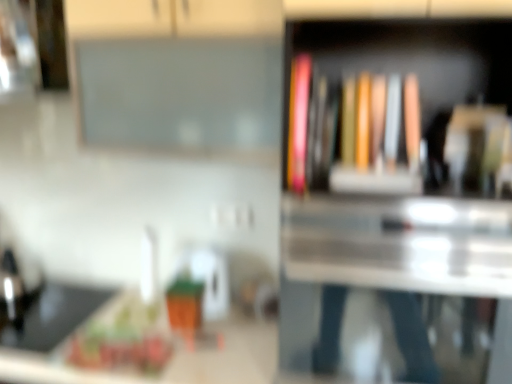
Where is `white glossy counter top at lower left`? The width and height of the screenshot is (512, 384). white glossy counter top at lower left is located at coordinates (168, 361).

What is the approximate width of white glossy kettle at center?

white glossy kettle at center is 5.50 inches in width.

In order to click on black matte sink at lower left in this screenshot , I will do click(x=38, y=301).

Find the location of a particular element. This screenshot has height=384, width=512. white glossy counter top at lower left is located at coordinates (168, 361).

Can you confirm if matte hardcover book at center, positioned as the first book in right-to-left order, is positioned to the left of white glossy counter top at lower left?

Incorrect, matte hardcover book at center, positioned as the first book in right-to-left order, is not on the left side of white glossy counter top at lower left.

Which is less distant, (x=315, y=166) or (x=146, y=382)?

The point (x=315, y=166) is in front.

From the image's perspective, which one is positioned higher, matte hardcover book at center, positioned as the first book in right-to-left order, or white glossy counter top at lower left?

matte hardcover book at center, positioned as the first book in right-to-left order.

Is the position of matte pink book at upper right, the first book from the left, less distant than that of black matte sink at lower left?

Yes, matte pink book at upper right, the first book from the left, is closer to the viewer.

From a real-world perspective, which object rests below the other?

From a 3D spatial view, black matte sink at lower left is below.

Looking at this image, between matte pink book at upper right, the first book from the left, and black matte sink at lower left, which one has larger size?

With larger size is black matte sink at lower left.

Is matte pink book at upper right, the first book from the left, inside or outside of black matte sink at lower left?

The correct answer is: outside.

Which is in front, point (429, 154) or point (80, 304)?

The point (429, 154) is more forward.

From a real-world perspective, relative to black matte sink at lower left, is wooden bookshelf at center vertically above or below?

wooden bookshelf at center is above black matte sink at lower left.

Is wooden bookshelf at center further to the viewer compared to black matte sink at lower left?

No, it is not.

Considering the relative sizes of wooden bookshelf at center and black matte sink at lower left in the image provided, is wooden bookshelf at center thinner than black matte sink at lower left?

No.

Is matte pink book at upper right, the first book from the left, surrounding white glossy counter top at lower left?

No, white glossy counter top at lower left is not a part of matte pink book at upper right, the first book from the left.

Between matte pink book at upper right, the second book viewed from the right, and white glossy counter top at lower left, which one has smaller width?

matte pink book at upper right, the second book viewed from the right, is thinner.

Identify the location of book that is the 2nd one when counting upward from the white glossy counter top at lower left (from the image's perspective). (298, 122).

From a real-world perspective, is matte pink book at upper right, the first book from the left, over white glossy counter top at lower left?

Yes, from a real-world perspective, matte pink book at upper right, the first book from the left, is on top of white glossy counter top at lower left.

Is point (294, 151) farther from camera compared to point (416, 126)?

Yes, it is.

Visually, is matte pink book at upper right, the second book viewed from the right, positioned to the left or to the right of matte hardcover book at center, positioned as the first book in right-to-left order?

Clearly, matte pink book at upper right, the second book viewed from the right, is on the left of matte hardcover book at center, positioned as the first book in right-to-left order, in the image.

From a real-world perspective, is matte pink book at upper right, the first book from the left, over matte hardcover book at center, the second book from the left?

Yes, from a real-world perspective, matte pink book at upper right, the first book from the left, is above matte hardcover book at center, the second book from the left.

In terms of width, does matte pink book at upper right, the first book from the left, look wider or thinner when compared to matte hardcover book at center, positioned as the first book in right-to-left order?

Clearly, matte pink book at upper right, the first book from the left, has less width compared to matte hardcover book at center, positioned as the first book in right-to-left order.

From the image's perspective, is white glossy counter top at lower left below wooden bookshelf at center?

Yes, from the image's perspective, white glossy counter top at lower left is below wooden bookshelf at center.

Looking at this image, looking at the image, does white glossy counter top at lower left seem bigger or smaller compared to wooden bookshelf at center?

In the image, white glossy counter top at lower left appears to be larger than wooden bookshelf at center.

Is the surface of white glossy counter top at lower left in direct contact with wooden bookshelf at center?

white glossy counter top at lower left is not next to wooden bookshelf at center, and they're not touching.

What's the angular difference between white glossy counter top at lower left and wooden bookshelf at center's facing directions?

The facing directions of white glossy counter top at lower left and wooden bookshelf at center are 0.751 degrees apart.

How different are the orientations of matte hardcover book at center, the second book from the left, and wooden bookshelf at center in degrees?

The facing directions of matte hardcover book at center, the second book from the left, and wooden bookshelf at center are 1.17 degrees apart.

From a real-world perspective, is matte hardcover book at center, the second book from the left, located beneath wooden bookshelf at center?

No.

Consider the image. From the image's perspective, is matte hardcover book at center, the second book from the left, below wooden bookshelf at center?

Incorrect, from the image's perspective, matte hardcover book at center, the second book from the left, is higher than wooden bookshelf at center.

Could you tell me if matte hardcover book at center, positioned as the first book in right-to-left order, is facing wooden bookshelf at center?

Yes, matte hardcover book at center, positioned as the first book in right-to-left order, is oriented towards wooden bookshelf at center.

The height and width of the screenshot is (384, 512). Find the location of `the 1st book directly above the white glossy counter top at lower left (from a real-world perspective)`. the 1st book directly above the white glossy counter top at lower left (from a real-world perspective) is located at coordinates (353, 132).

You are a GUI agent. You are given a task and a screenshot of the screen. Output one action in this format:
    pyautogui.click(x=<x>, y=<y>)
    Task: Click on the sink located behind the matte pink book at upper right, the second book viewed from the right
    This screenshot has height=384, width=512.
    Given the screenshot: What is the action you would take?
    coord(38,301)

Looking at the image, which one is located closer to matte pink book at upper right, the first book from the left, white glossy kettle at center or matte hardcover book at center, positioned as the first book in right-to-left order?

matte hardcover book at center, positioned as the first book in right-to-left order, lies closer to matte pink book at upper right, the first book from the left, than the other object.

Estimate the real-world distances between objects in this image. Which object is closer to matte hardcover book at center, positioned as the first book in right-to-left order, white glossy counter top at lower left or matte pink book at upper right, the first book from the left?

matte pink book at upper right, the first book from the left, lies closer to matte hardcover book at center, positioned as the first book in right-to-left order, than the other object.

Based on their spatial positions, is white glossy kettle at center or matte pink book at upper right, the second book viewed from the right, closer to matte hardcover book at center, positioned as the first book in right-to-left order?

Based on the image, matte pink book at upper right, the second book viewed from the right, appears to be nearer to matte hardcover book at center, positioned as the first book in right-to-left order.

Estimate the real-world distances between objects in this image. Which object is closer to white glossy kettle at center, white glossy counter top at lower left or matte hardcover book at center, positioned as the first book in right-to-left order?

white glossy counter top at lower left is closer to white glossy kettle at center.

From the image, which object appears to be nearer to matte hardcover book at center, positioned as the first book in right-to-left order, white glossy counter top at lower left or white glossy kettle at center?

white glossy counter top at lower left.

When comparing their distances from black matte sink at lower left, does white glossy counter top at lower left or wooden bookshelf at center seem closer?

The object closer to black matte sink at lower left is white glossy counter top at lower left.

From the image, which object appears to be nearer to white glossy kettle at center, black matte sink at lower left or white glossy counter top at lower left?

The object closer to white glossy kettle at center is white glossy counter top at lower left.

Estimate the real-world distances between objects in this image. Which object is further from white glossy kettle at center, matte hardcover book at center, positioned as the first book in right-to-left order, or matte pink book at upper right, the first book from the left?

Among the two, matte hardcover book at center, positioned as the first book in right-to-left order, is located further to white glossy kettle at center.

Where is `book between matte pink book at upper right, the second book viewed from the right, and white glossy counter top at lower left, in the vertical direction`? The height and width of the screenshot is (384, 512). book between matte pink book at upper right, the second book viewed from the right, and white glossy counter top at lower left, in the vertical direction is located at coordinates (353, 132).

Where is `counter top situated between black matte sink at lower left and white glossy kettle at center from left to right`? counter top situated between black matte sink at lower left and white glossy kettle at center from left to right is located at coordinates (168, 361).

Locate an element on the screen. book between matte hardcover book at center, positioned as the first book in right-to-left order, and white glossy kettle at center in the front-back direction is located at coordinates (298, 122).

This screenshot has height=384, width=512. I want to click on book between black matte sink at lower left and matte hardcover book at center, positioned as the first book in right-to-left order, from left to right, so click(298, 122).